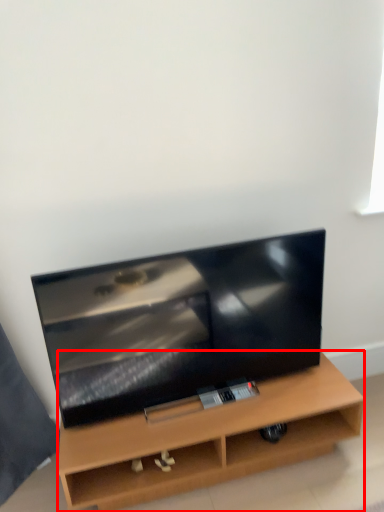
Question: Where is furniture (annotated by the red box) located in relation to television in the image?

Choices:
 (A) left
 (B) right

Answer: (B)